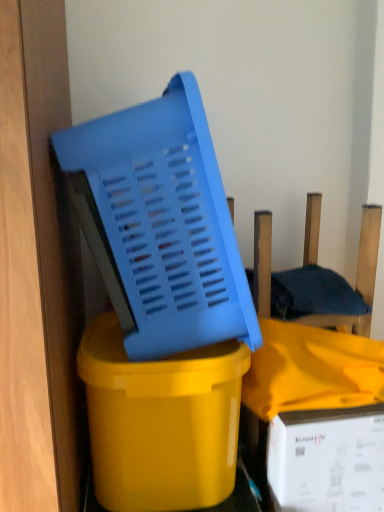
Question: From the image's perspective, is white cardboard box at lower right on top of blue plastic chair at center?

Choices:
 (A) yes
 (B) no

Answer: (B)

Question: Considering the relative positions of white cardboard box at lower right and blue plastic chair at center in the image provided, is white cardboard box at lower right in front of blue plastic chair at center?

Choices:
 (A) yes
 (B) no

Answer: (B)

Question: Is white cardboard box at lower right far away from blue plastic chair at center?

Choices:
 (A) yes
 (B) no

Answer: (B)

Question: Is white cardboard box at lower right to the left of blue plastic chair at center from the viewer's perspective?

Choices:
 (A) yes
 (B) no

Answer: (B)

Question: From a real-world perspective, is white cardboard box at lower right physically below blue plastic chair at center?

Choices:
 (A) yes
 (B) no

Answer: (A)

Question: Does white cardboard box at lower right appear on the right side of blue plastic chair at center?

Choices:
 (A) no
 (B) yes

Answer: (B)

Question: Is blue plastic basket at center looking in the opposite direction of white cardboard box at lower right?

Choices:
 (A) yes
 (B) no

Answer: (B)

Question: Is the position of blue plastic basket at center more distant than that of white cardboard box at lower right?

Choices:
 (A) yes
 (B) no

Answer: (B)

Question: Does blue plastic basket at center have a lesser width compared to white cardboard box at lower right?

Choices:
 (A) yes
 (B) no

Answer: (B)

Question: Could white cardboard box at lower right be considered to be inside blue plastic basket at center?

Choices:
 (A) yes
 (B) no

Answer: (B)

Question: From a real-world perspective, is blue plastic basket at center under white cardboard box at lower right?

Choices:
 (A) yes
 (B) no

Answer: (B)

Question: From the image's perspective, is blue plastic basket at center located beneath white cardboard box at lower right?

Choices:
 (A) no
 (B) yes

Answer: (A)

Question: From a real-world perspective, is blue plastic chair at center under white cardboard box at lower right?

Choices:
 (A) no
 (B) yes

Answer: (A)